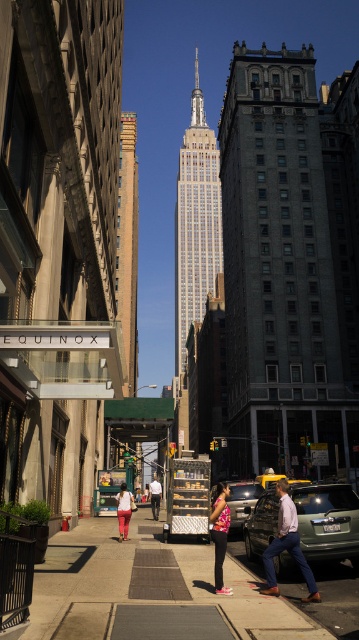
What is located at the coordinates point (288, 266) in the image?

The dark gray stone building at center is located at point (288, 266).

In the urban street scene with the Empire State Building in the background, there is a point marked at coordinates [220,534]. What object is located at this point?

The pink floral shirt at center is located at point [220,534].

You are a photographer aiming to capture the Empire State Building in the background while focusing on the pink floral shirt at center and the metallic silver taxi at center. Which object should you adjust your camera focus to first to ensure both are in the frame?

The pink floral shirt at center is positioned over the metallic silver taxi at center, so you should focus on the pink floral shirt at center first to ensure it is visible above the taxi in the photo.